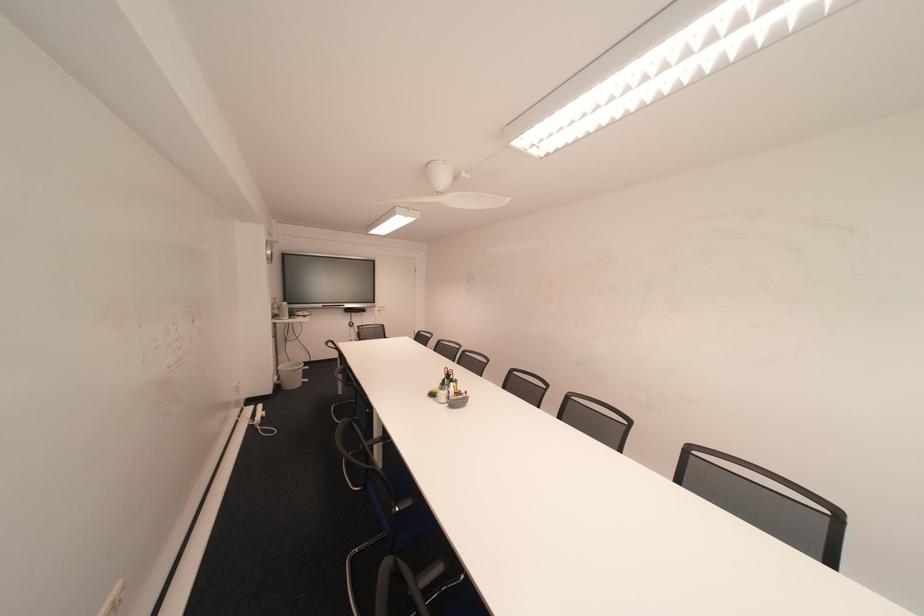
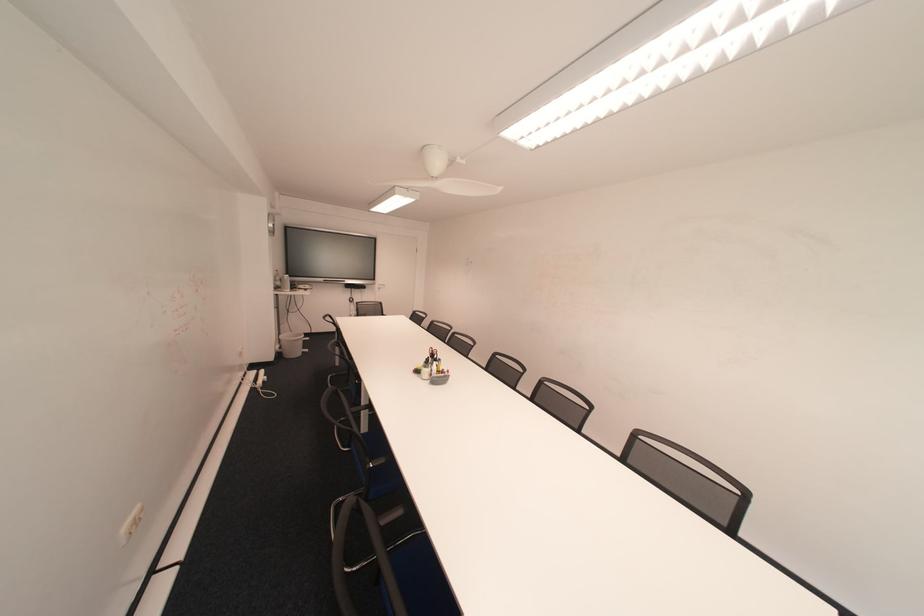
The images are taken continuously from a first-person perspective. In which direction are you moving?

The movement direction of the cameraman is right, backward.